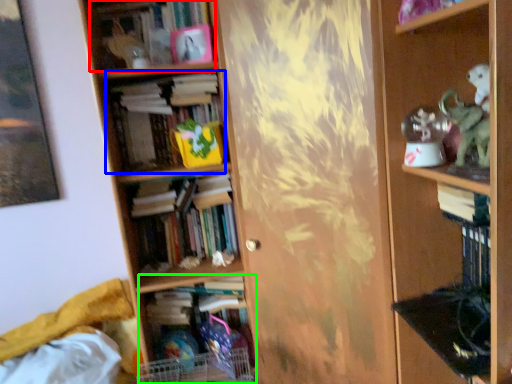
Question: Which is farther away from book (highlighted by a red box)? book (highlighted by a blue box) or book (highlighted by a green box)?

Choices:
 (A) book
 (B) book

Answer: (B)